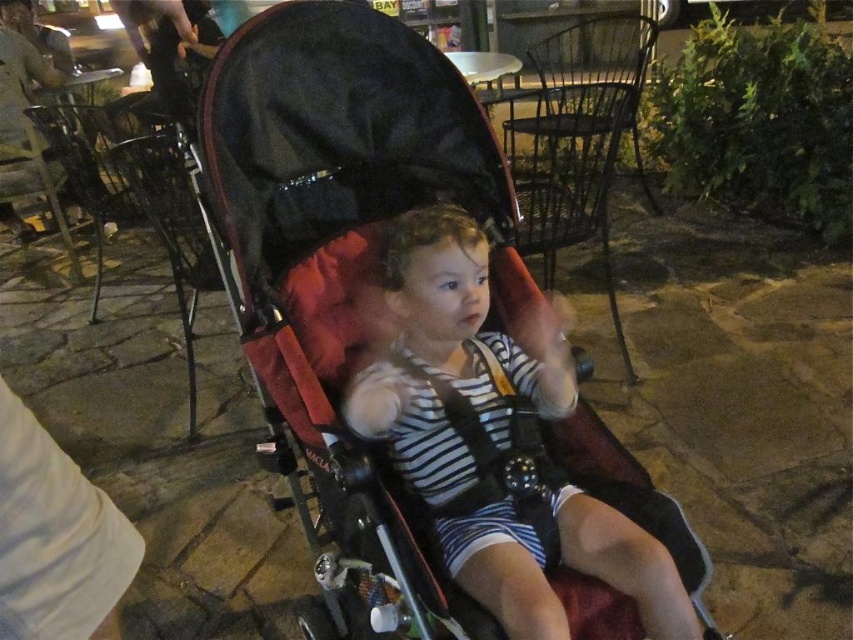
From the picture: Who is taller, red fabric stroller at center or striped fabric toddler at center?

With more height is red fabric stroller at center.

In the scene shown: Is red fabric stroller at center to the left of striped fabric toddler at center from the viewer's perspective?

Correct, you'll find red fabric stroller at center to the left of striped fabric toddler at center.

Where is `red fabric stroller at center`? The width and height of the screenshot is (853, 640). red fabric stroller at center is located at coordinates (343, 259).